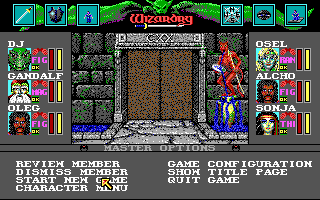
You are a GUI agent. You are given a task and a screenshot of the screen. Output one action in this format:
    pyautogui.click(x=<x>, y=<y>)
    Task: Click on the doors
    This screenshot has width=320, height=200.
    Given the screenshot: What is the action you would take?
    pyautogui.click(x=145, y=84), pyautogui.click(x=175, y=85)